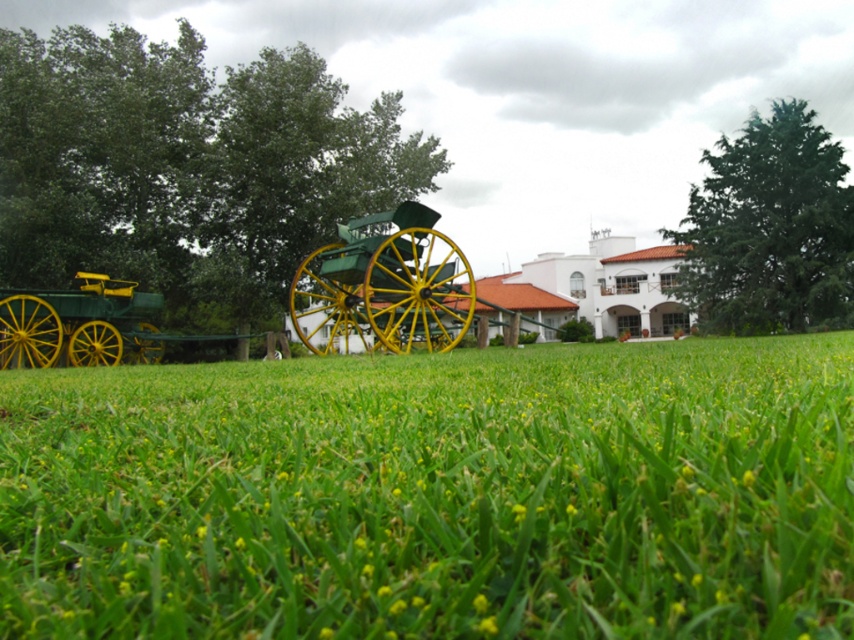
Which is more to the right, green polished wood wagon at center or green matte wagon at left?

green polished wood wagon at center

Does green polished wood wagon at center have a lesser height compared to green matte wagon at left?

No, green polished wood wagon at center is not shorter than green matte wagon at left.

What do you see at coordinates (384, 285) in the screenshot? The width and height of the screenshot is (854, 640). I see `green polished wood wagon at center` at bounding box center [384, 285].

Find the location of a particular element. This screenshot has height=640, width=854. green polished wood wagon at center is located at coordinates (384, 285).

Is the position of green grass at center less distant than that of green matte wagon at left?

That is True.

Does green grass at center appear under green matte wagon at left?

Yes.

Is point (733, 621) less distant than point (7, 330)?

Yes.

What are the coordinates of `green grass at center` in the screenshot? It's located at (436, 493).

Between green grass at center and green polished wood wagon at center, which one is positioned higher?

green polished wood wagon at center

How distant is green grass at center from green polished wood wagon at center?

18.52 meters

The height and width of the screenshot is (640, 854). Identify the location of green grass at center. (436, 493).